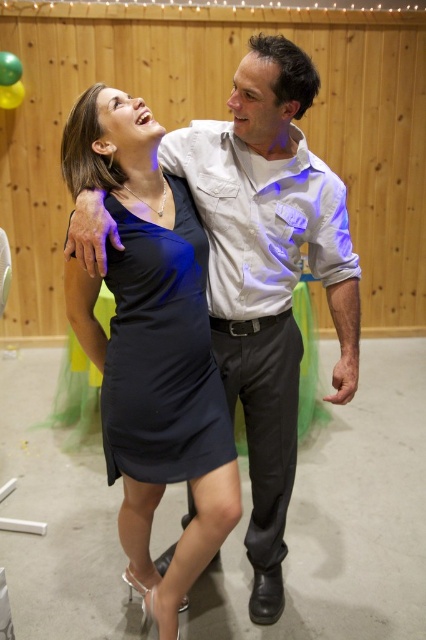
Question: Based on their relative distances, which object is farther from the green matte balloon at upper left?

Choices:
 (A) yellow rubber balloon at upper left
 (B) satin black dress at center
 (C) black satin dress at center

Answer: (C)

Question: Is satin black dress at center smaller than green matte balloon at upper left?

Choices:
 (A) no
 (B) yes

Answer: (A)

Question: Estimate the real-world distances between objects in this image. Which object is farther from the black satin dress at center?

Choices:
 (A) yellow rubber balloon at upper left
 (B) green matte balloon at upper left
 (C) satin black dress at center

Answer: (A)

Question: Which object is closer to the camera taking this photo?

Choices:
 (A) yellow rubber balloon at upper left
 (B) black satin dress at center

Answer: (B)

Question: Where is satin black dress at center located in relation to black satin dress at center in the image?

Choices:
 (A) right
 (B) left

Answer: (B)

Question: From the image, what is the correct spatial relationship of satin black dress at center in relation to black satin dress at center?

Choices:
 (A) below
 (B) above

Answer: (A)